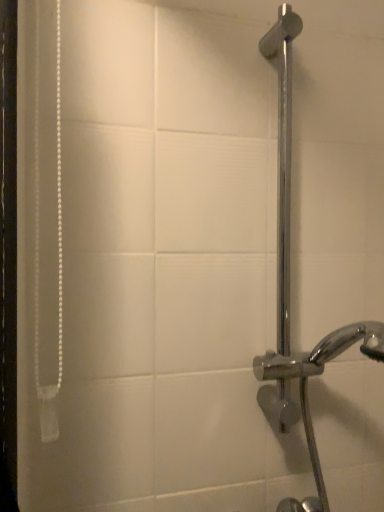
You are a GUI agent. You are given a task and a screenshot of the screen. Output one action in this format:
    pyautogui.click(x=<x>, y=<y>)
    Task: Click on the chrome metallic shower at right
    Image resolution: width=384 pixels, height=512 pixels.
    Given the screenshot: What is the action you would take?
    pyautogui.click(x=283, y=238)

Describe the element at coordinates (283, 238) in the screenshot. Image resolution: width=384 pixels, height=512 pixels. I see `chrome metallic shower at right` at that location.

You are a GUI agent. You are given a task and a screenshot of the screen. Output one action in this format:
    pyautogui.click(x=<x>, y=<y>)
    Task: Click on the chrome metallic shower at right
    The image size is (384, 512).
    Given the screenshot: What is the action you would take?
    pyautogui.click(x=283, y=238)